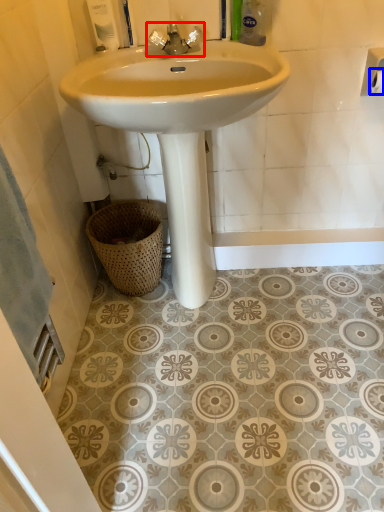
Question: Which object is further to the camera taking this photo, tap (highlighted by a red box) or toilet paper (highlighted by a blue box)?

Choices:
 (A) tap
 (B) toilet paper

Answer: (B)